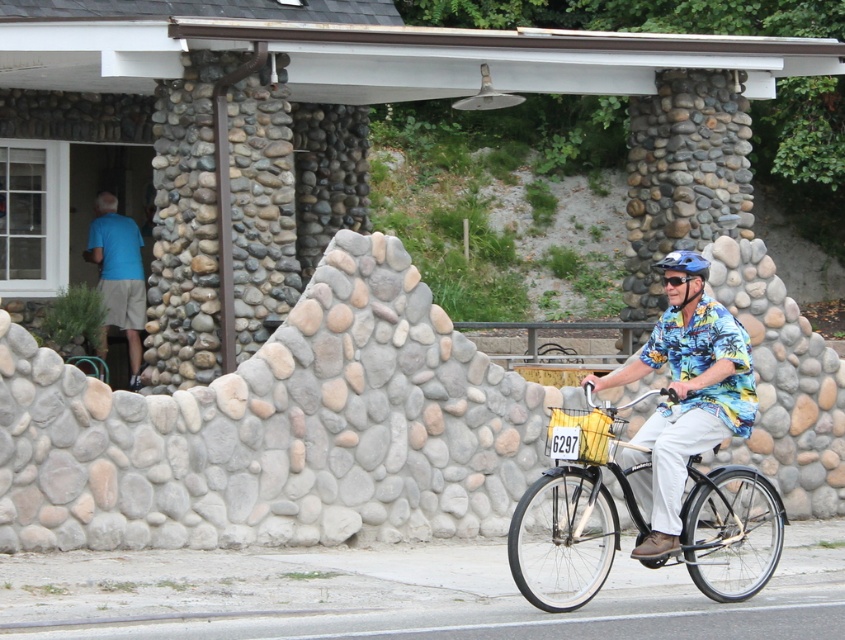
Question: Can you confirm if black matte bicycle at center is positioned above blue matte helmet at center?

Choices:
 (A) no
 (B) yes

Answer: (A)

Question: Is floral print shirt at center above yellow fabric basket at center?

Choices:
 (A) yes
 (B) no

Answer: (A)

Question: In this image, where is yellow fabric basket at center located relative to blue matte helmet at center?

Choices:
 (A) left
 (B) right

Answer: (A)

Question: Which point is closer to the camera taking this photo?

Choices:
 (A) (704, 522)
 (B) (589, 420)
 (C) (696, 332)
 (D) (657, 262)

Answer: (B)

Question: Which of the following is the closest to the observer?

Choices:
 (A) (537, 488)
 (B) (672, 288)

Answer: (A)

Question: Considering the real-world distances, which object is farthest from the black matte bicycle at center?

Choices:
 (A) blue matte helmet at center
 (B) yellow fabric basket at center

Answer: (A)